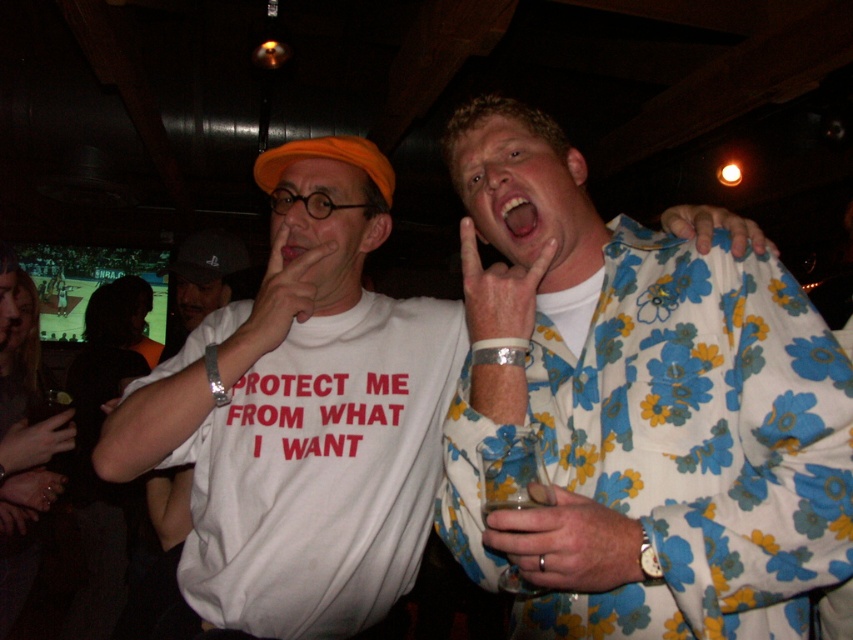
Can you confirm if floral-patterned shirt at upper right is bigger than white cotton t-shirt at center?

Correct, floral-patterned shirt at upper right is larger in size than white cotton t-shirt at center.

What do you see at coordinates (637, 408) in the screenshot? The width and height of the screenshot is (853, 640). I see `floral-patterned shirt at upper right` at bounding box center [637, 408].

The width and height of the screenshot is (853, 640). What do you see at coordinates (637, 408) in the screenshot? I see `floral-patterned shirt at upper right` at bounding box center [637, 408].

I want to click on floral-patterned shirt at upper right, so click(x=637, y=408).

How much distance is there between floral-patterned shirt at upper right and white fabric shirt at center?

floral-patterned shirt at upper right and white fabric shirt at center are 11.96 inches apart from each other.

Between floral-patterned shirt at upper right and white fabric shirt at center, which one has less height?

Standing shorter between the two is floral-patterned shirt at upper right.

Identify the location of floral-patterned shirt at upper right. (637, 408).

Which is more to the right, white fabric shirt at center or white cotton t-shirt at center?

From the viewer's perspective, white fabric shirt at center appears more on the right side.

Does point (376, 508) lie in front of point (375, 300)?

That is True.

Which is behind, point (425, 352) or point (281, 573)?

Positioned behind is point (425, 352).

This screenshot has width=853, height=640. What are the coordinates of `white fabric shirt at center` in the screenshot? It's located at pyautogui.click(x=303, y=413).